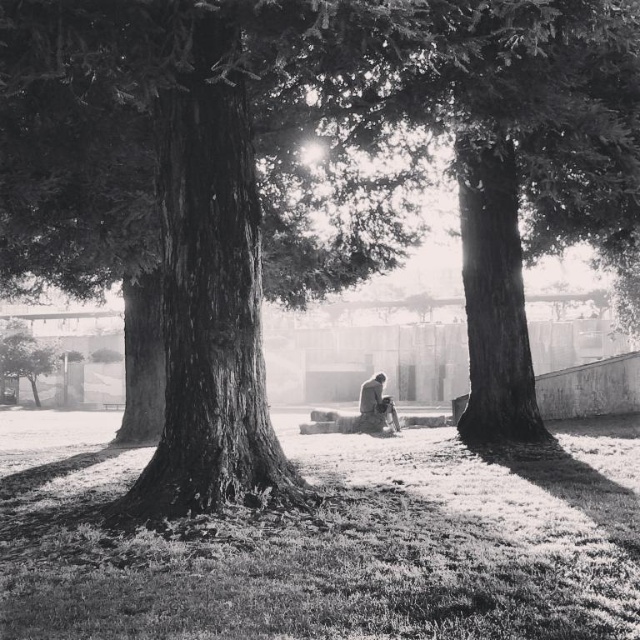
You are standing in the middle of the scene and want to sit down on the smooth gray stone bench at center. Which direction should you move to reach it from the fuzzy grass at center?

You should move to the right from the fuzzy grass at center to reach the smooth gray stone bench at center because the fuzzy grass at center is located to the left of the smooth gray stone bench at center.